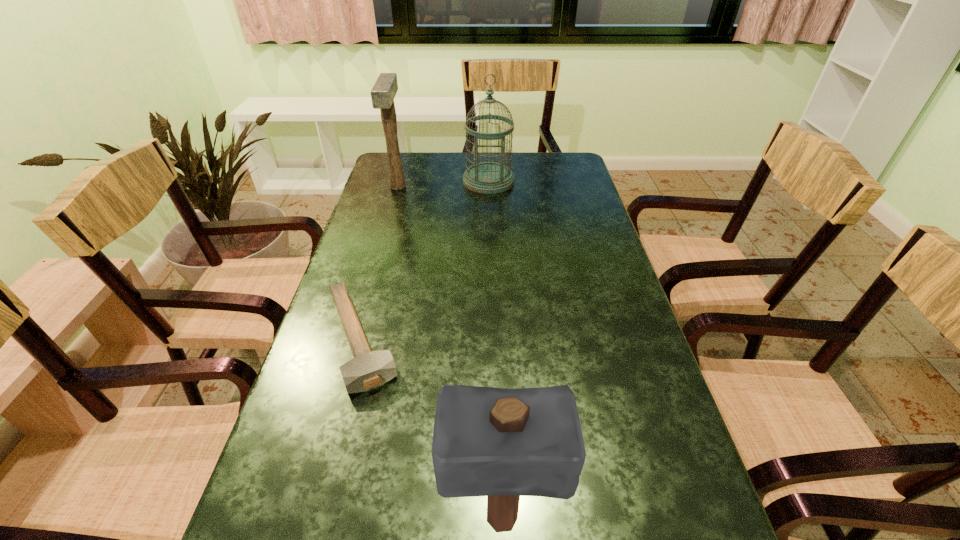
Locate an element on the screen. The image size is (960, 540). birdcage is located at coordinates (486, 177).

Find the location of a particular element. This screenshot has width=960, height=540. the farthest mallet is located at coordinates (384, 90).

I want to click on the second nearest mallet, so click(368, 369).

Find the location of a particular element. the shortest object is located at coordinates (368, 369).

Locate an element on the screen. Image resolution: width=960 pixels, height=540 pixels. vacant space located on the front-facing side of the birdcage is located at coordinates (491, 259).

What are the coordinates of `free region located on the right of the farthest mallet` in the screenshot? It's located at (429, 187).

What are the coordinates of `vacant region located 0.180m on the front of the second farthest mallet` in the screenshot? It's located at (322, 488).

The image size is (960, 540). In order to click on birdcage that is at the far edge in this screenshot , I will do `click(486, 177)`.

Locate an element on the screen. This screenshot has height=540, width=960. mallet that is at the far edge is located at coordinates (384, 90).

The image size is (960, 540). I want to click on object at the far left corner, so click(384, 90).